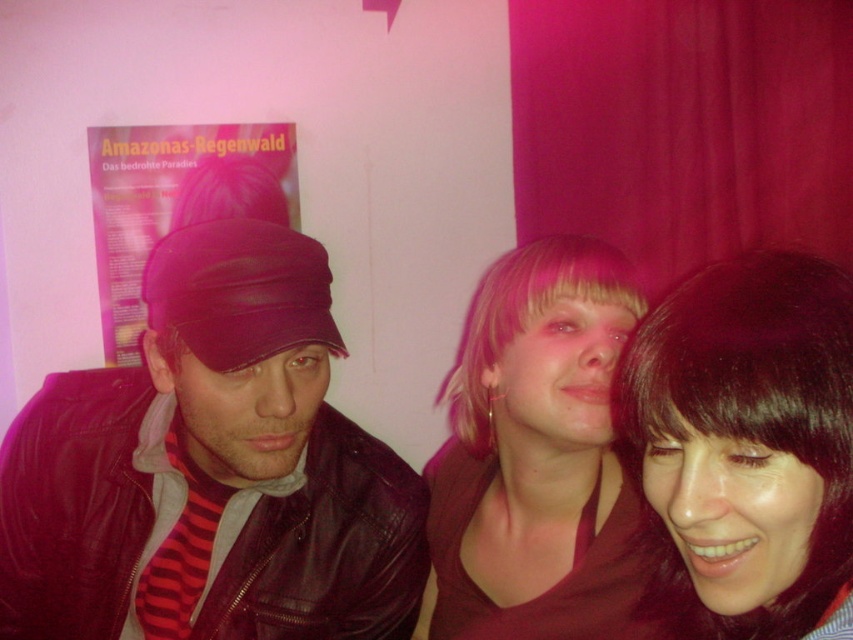
You are standing at point (3, 452) and want to reach the Amazonas poster on the wall. The distance between you and the poster is 1.13 meters. If you have a 1.2 meter long pole, can you safely reach the poster without moving closer?

Yes, the pole is 1.2 meters long, which is longer than the 1.13 meters distance between you and the poster, so you can safely reach it without moving closer.

You are taking a photo of the three people in the scene. You want to ensure that both the pink hair at center and the blondehair at center are fully visible in the frame. Based on their positions, is there a chance that one might be blocking the other?

The pink hair at center might be wider than blondehair at center, so there is a possibility that the pink hair at center could be blocking part of the blondehair at center if they are positioned closely together.